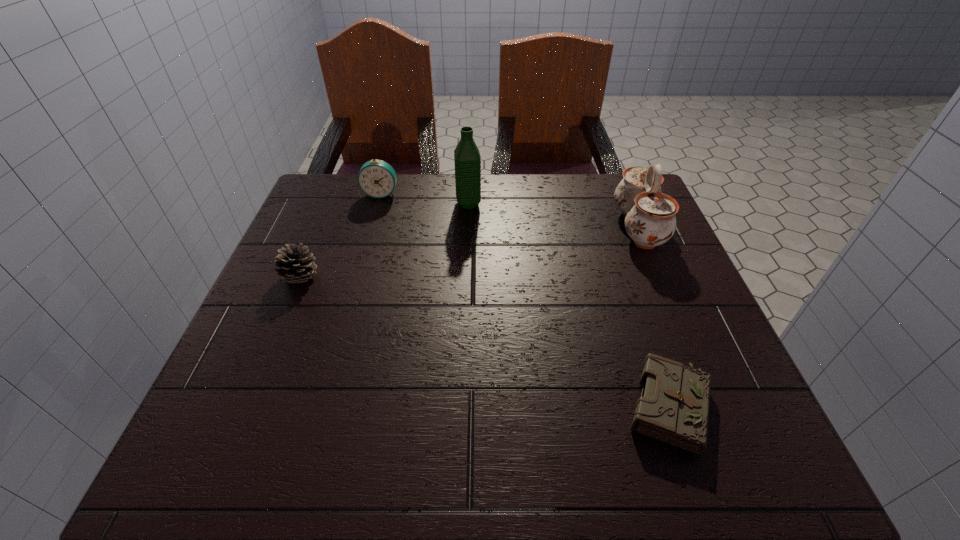
Where is `free space at the far left corner of the desktop`? free space at the far left corner of the desktop is located at coordinates (313, 208).

This screenshot has height=540, width=960. I want to click on blank area at the far right corner, so click(x=603, y=174).

You are a GUI agent. You are given a task and a screenshot of the screen. Output one action in this format:
    pyautogui.click(x=<x>, y=<y>)
    Task: Click on the vacant area at the near right corner
    The width and height of the screenshot is (960, 540).
    Given the screenshot: What is the action you would take?
    pyautogui.click(x=776, y=460)

Find the location of a particular element. Image resolution: width=960 pixels, height=540 pixels. unoccupied position between the third object from right to left and the diary is located at coordinates (569, 305).

The image size is (960, 540). Identify the location of vacant space that is in between the fourth object from right to left and the diary. pos(525,300).

I want to click on vacant area between the leftmost object and the chinaware, so click(469, 253).

The image size is (960, 540). What are the coordinates of `empty space between the leftmost object and the shortest object` in the screenshot? It's located at (485, 342).

Locate an element on the screen. This screenshot has height=540, width=960. vacant space that's between the diary and the water bottle is located at coordinates (569, 305).

Locate an element on the screen. free space that is in between the second nearest object and the second tallest object is located at coordinates (469, 253).

Image resolution: width=960 pixels, height=540 pixels. Identify the location of free space between the third object from left to right and the shortest object. (569, 305).